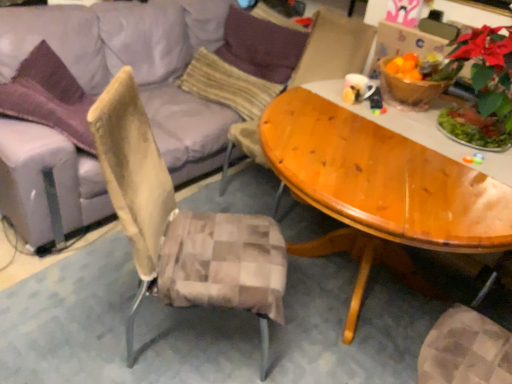
Question: Is purple fabric pillow at upper center, which ranks as the 1th pillow in top-to-bottom order, at the right side of light gray fabric couch at upper left?

Choices:
 (A) no
 (B) yes

Answer: (B)

Question: Could you tell me if purple fabric pillow at upper center, the 2th pillow from the bottom, is facing light gray fabric couch at upper left?

Choices:
 (A) yes
 (B) no

Answer: (A)

Question: From a real-world perspective, is purple fabric pillow at upper center, which ranks as the 1th pillow in top-to-bottom order, below light gray fabric couch at upper left?

Choices:
 (A) no
 (B) yes

Answer: (A)

Question: Is light gray fabric couch at upper left a part of purple fabric pillow at upper center, the 2th pillow from the bottom?

Choices:
 (A) no
 (B) yes

Answer: (A)

Question: Is purple fabric pillow at upper center, the 2th pillow from the bottom, closer to the viewer compared to light gray fabric couch at upper left?

Choices:
 (A) no
 (B) yes

Answer: (A)

Question: Would you say purple fabric pillow at upper center, which ranks as the 1th pillow in top-to-bottom order, is inside or outside green matte poinsettia at upper right?

Choices:
 (A) inside
 (B) outside

Answer: (B)

Question: Looking at their shapes, would you say purple fabric pillow at upper center, the 2th pillow from the bottom, is wider or thinner than green matte poinsettia at upper right?

Choices:
 (A) wide
 (B) thin

Answer: (A)

Question: From the image's perspective, is purple fabric pillow at upper center, the 2th pillow from the bottom, positioned above or below green matte poinsettia at upper right?

Choices:
 (A) below
 (B) above

Answer: (B)

Question: Would you say purple fabric pillow at upper center, which ranks as the 1th pillow in top-to-bottom order, is to the left or to the right of green matte poinsettia at upper right in the picture?

Choices:
 (A) right
 (B) left

Answer: (B)

Question: Is beige textured pillow at center, the first pillow ordered from the bottom, in front of or behind green matte poinsettia at upper right in the image?

Choices:
 (A) behind
 (B) front

Answer: (A)

Question: From the image's perspective, is beige textured pillow at center, positioned as the 2th pillow in top-to-bottom order, above or below green matte poinsettia at upper right?

Choices:
 (A) above
 (B) below

Answer: (B)

Question: In terms of size, does beige textured pillow at center, the first pillow ordered from the bottom, appear bigger or smaller than green matte poinsettia at upper right?

Choices:
 (A) big
 (B) small

Answer: (A)

Question: Considering the positions of beige textured pillow at center, the first pillow ordered from the bottom, and green matte poinsettia at upper right in the image, is beige textured pillow at center, the first pillow ordered from the bottom, taller or shorter than green matte poinsettia at upper right?

Choices:
 (A) short
 (B) tall

Answer: (B)

Question: In terms of height, does beige textured pillow at center, positioned as the 2th pillow in top-to-bottom order, look taller or shorter compared to light gray fabric couch at upper left?

Choices:
 (A) short
 (B) tall

Answer: (A)

Question: From the image's perspective, relative to light gray fabric couch at upper left, is beige textured pillow at center, the first pillow ordered from the bottom, above or below?

Choices:
 (A) below
 (B) above

Answer: (B)